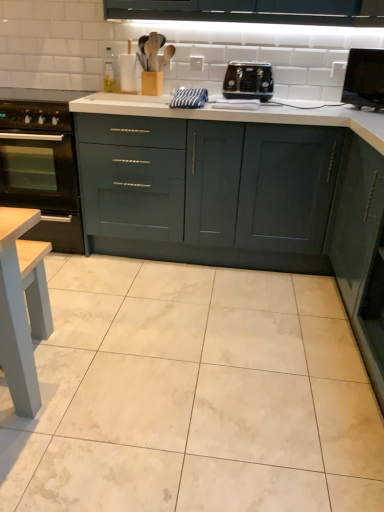
Question: Is matte dark green cabinet at right, which is counted as the 2th cabinetry, starting from the back, at the right side of black matte gas stove at left?

Choices:
 (A) yes
 (B) no

Answer: (A)

Question: Is matte dark green cabinet at right, marked as the first cabinetry in a front-to-back arrangement, taller than black matte gas stove at left?

Choices:
 (A) no
 (B) yes

Answer: (B)

Question: Is matte dark green cabinet at right, which is counted as the 2th cabinetry, starting from the back, behind black matte gas stove at left?

Choices:
 (A) no
 (B) yes

Answer: (A)

Question: Can you confirm if matte dark green cabinet at right, marked as the first cabinetry in a front-to-back arrangement, is bigger than black matte gas stove at left?

Choices:
 (A) no
 (B) yes

Answer: (B)

Question: Is matte dark green cabinet at right, which is counted as the 2th cabinetry, starting from the back, at the left side of black matte gas stove at left?

Choices:
 (A) no
 (B) yes

Answer: (A)

Question: Considering their positions, is black glass oven at lower left located in front of or behind matte dark green cabinet at right, the second cabinetry in the left-to-right sequence?

Choices:
 (A) front
 (B) behind

Answer: (B)

Question: From a real-world perspective, is black glass oven at lower left above or below matte dark green cabinet at right, the second cabinetry in the left-to-right sequence?

Choices:
 (A) below
 (B) above

Answer: (A)

Question: Is black glass oven at lower left spatially inside matte dark green cabinet at right, which is counted as the 2th cabinetry, starting from the back, or outside of it?

Choices:
 (A) inside
 (B) outside

Answer: (B)

Question: In terms of width, does black glass oven at lower left look wider or thinner when compared to matte dark green cabinet at right, marked as the first cabinetry in a front-to-back arrangement?

Choices:
 (A) thin
 (B) wide

Answer: (B)

Question: In terms of width, does matte dark green cabinet at right, marked as the first cabinetry in a front-to-back arrangement, look wider or thinner when compared to teal matte cabinet at center, the 1th cabinetry positioned from the left?

Choices:
 (A) wide
 (B) thin

Answer: (B)

Question: From the image's perspective, relative to teal matte cabinet at center, which is counted as the second cabinetry, starting from the right, is matte dark green cabinet at right, which is counted as the 2th cabinetry, starting from the back, above or below?

Choices:
 (A) below
 (B) above

Answer: (A)

Question: Is matte dark green cabinet at right, marked as the first cabinetry in a front-to-back arrangement, bigger or smaller than teal matte cabinet at center, which is counted as the second cabinetry, starting from the right?

Choices:
 (A) big
 (B) small

Answer: (B)

Question: Considering the positions of matte dark green cabinet at right, placed as the first cabinetry when sorted from right to left, and teal matte cabinet at center, which is counted as the second cabinetry, starting from the right, in the image, is matte dark green cabinet at right, placed as the first cabinetry when sorted from right to left, taller or shorter than teal matte cabinet at center, which is counted as the second cabinetry, starting from the right,?

Choices:
 (A) tall
 (B) short

Answer: (A)

Question: Is black matte gas stove at left wider or thinner than black glossy monitor at upper right?

Choices:
 (A) wide
 (B) thin

Answer: (A)

Question: From the image's perspective, is black matte gas stove at left located above or below black glossy monitor at upper right?

Choices:
 (A) above
 (B) below

Answer: (B)